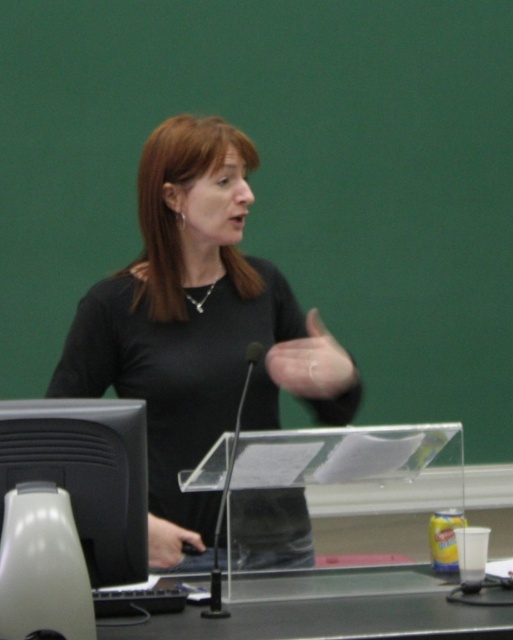
You are sitting in the audience and want to see both the black matte shirt at center and the black glossy monitor at lower left. Which one will appear closer to you?

The black matte shirt at center will appear closer to you because it is positioned further to the viewer than the black glossy monitor at lower left.

You are a photographer in the conference room and want to capture a photo of the black matte shirt at center and green plastic table at lower center. Which object should you focus on first if you want to ensure both are in sharp focus?

The black matte shirt at center is located above the green plastic table at lower center, so focusing on the black matte shirt at center first will ensure both are in sharp focus since it is closer to the camera.

You are an event planner setting up a conference room. You need to ensure that the black matte shirt at center and the green plastic table at lower center are arranged so that the shirt is to the right of the table. Is the current arrangement correct?

The black matte shirt at center is positioned on the left side of the green plastic table at lower center, so the current arrangement is incorrect because the shirt is to the left instead of the right.